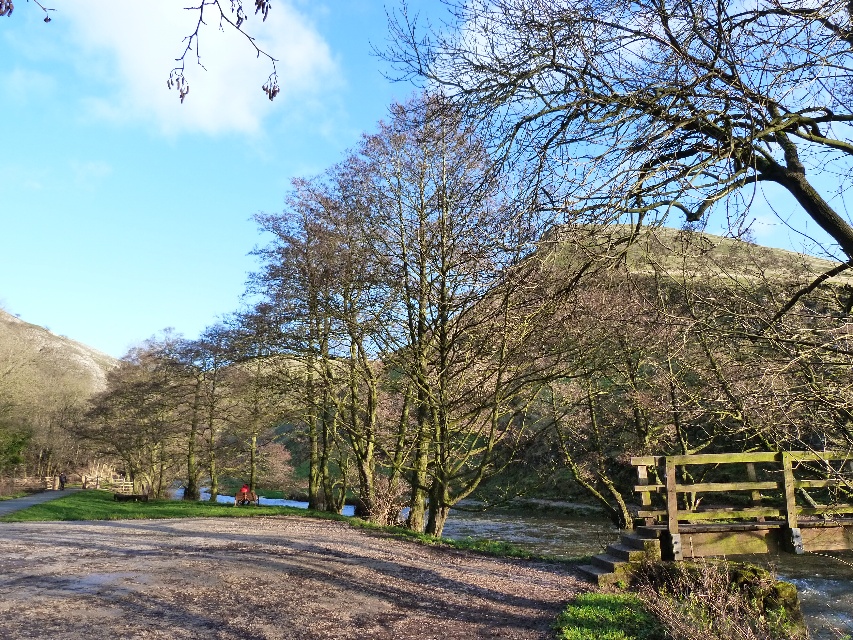
Does green mossy wood bridge at lower right appear on the right side of brown gravel path at lower left?

Yes, green mossy wood bridge at lower right is to the right of brown gravel path at lower left.

Which is behind, point (741, 525) or point (9, 502)?

Positioned behind is point (9, 502).

This screenshot has height=640, width=853. I want to click on green mossy wood bridge at lower right, so click(741, 502).

Does damp gravel path at lower center appear over green mossy wood bridge at lower right?

Actually, damp gravel path at lower center is below green mossy wood bridge at lower right.

Is damp gravel path at lower center further to the viewer compared to green mossy wood bridge at lower right?

No, damp gravel path at lower center is in front of green mossy wood bridge at lower right.

Between point (463, 557) and point (675, 550), which one is positioned behind?

Point (463, 557)

Where is `damp gravel path at lower center`? The height and width of the screenshot is (640, 853). damp gravel path at lower center is located at coordinates (262, 582).

Does damp gravel path at lower center have a greater height compared to brown gravel path at lower left?

Incorrect, damp gravel path at lower center's height is not larger of brown gravel path at lower left's.

Can you confirm if damp gravel path at lower center is positioned above brown gravel path at lower left?

Yes, damp gravel path at lower center is above brown gravel path at lower left.

Find the location of a particular element. This screenshot has width=853, height=640. damp gravel path at lower center is located at coordinates (262, 582).